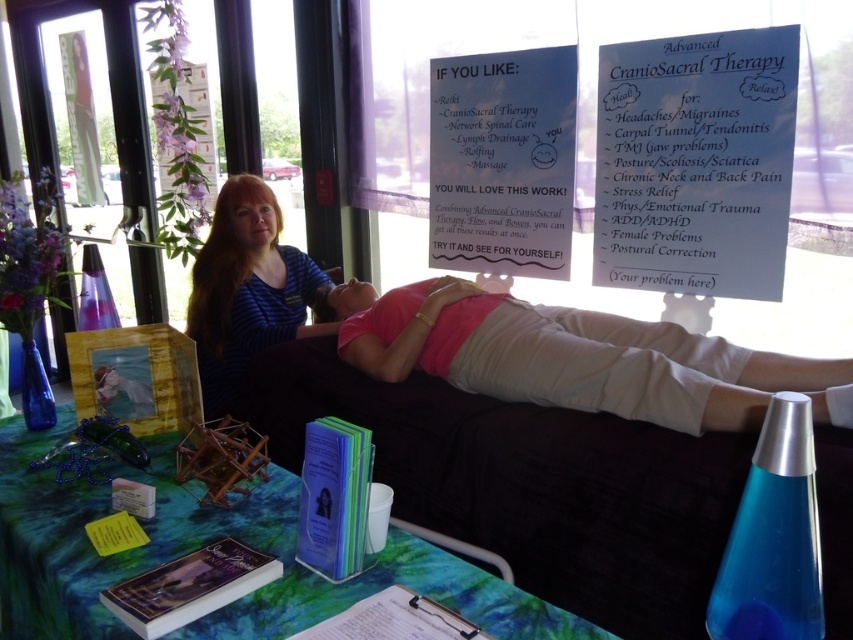
Question: Which object is positioned closest to the white paper sign at upper right?

Choices:
 (A) pink fabric at center
 (B) white paper sign at upper center
 (C) blue striped shirt at center
 (D) green fabric table at lower center

Answer: (B)

Question: Which of the following is the farthest from the observer?

Choices:
 (A) blue striped shirt at center
 (B) green fabric table at lower center
 (C) white paper sign at upper right
 (D) pink fabric at center

Answer: (A)

Question: Does pink fabric at center appear on the right side of blue striped shirt at center?

Choices:
 (A) yes
 (B) no

Answer: (A)

Question: Which object appears farthest from the camera in this image?

Choices:
 (A) white paper sign at upper right
 (B) white paper sign at upper center
 (C) green fabric table at lower center

Answer: (B)

Question: Is white paper sign at upper right positioned at the back of blue striped shirt at center?

Choices:
 (A) no
 (B) yes

Answer: (A)

Question: Is white paper sign at upper right thinner than white paper sign at upper center?

Choices:
 (A) yes
 (B) no

Answer: (A)